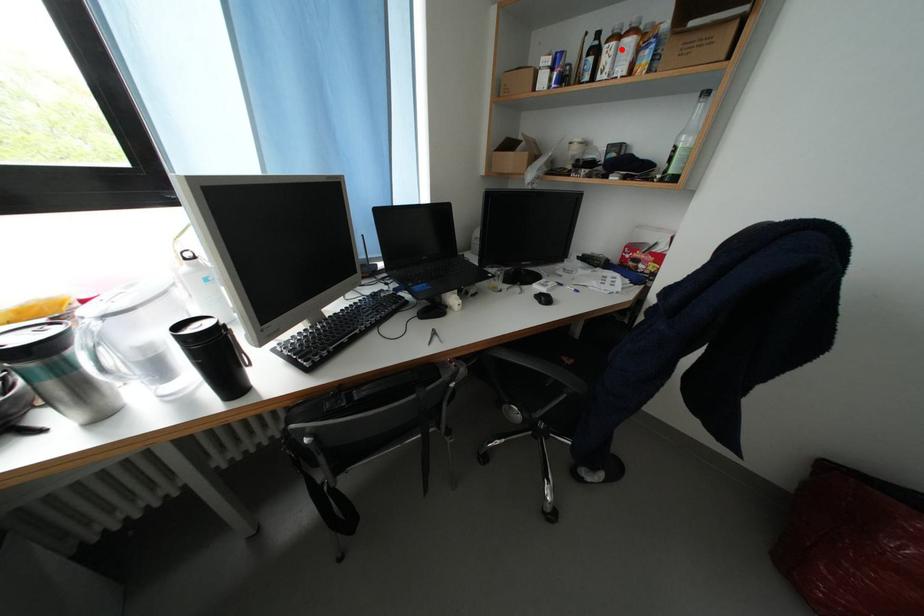
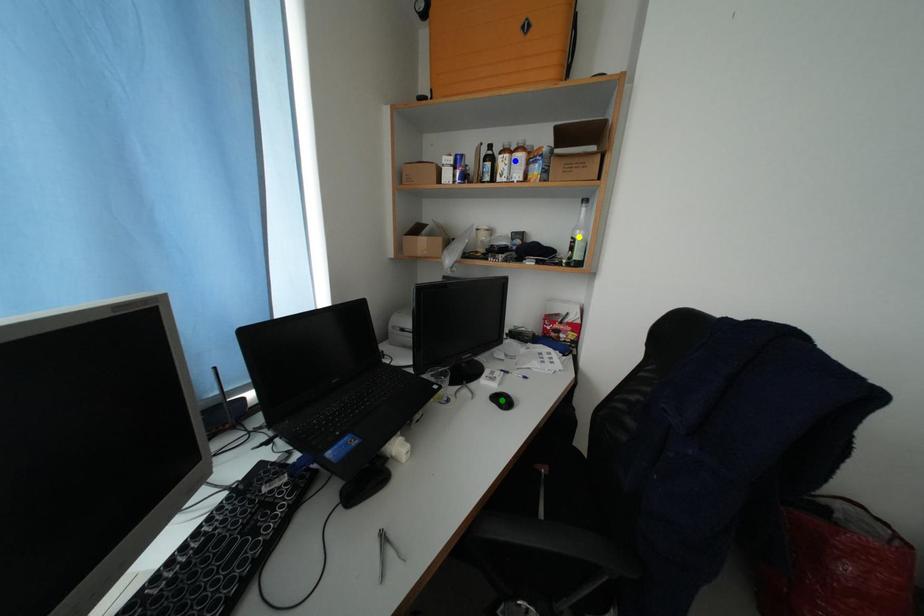
Question: I am providing you with two images of the same scene from different viewpoints. A red point is marked on the first image. You are given multiple points on the second image. Which point in image 2 represents the same 3d spot as the red point in image 1?

Choices:
 (A) blue point
 (B) yellow point
 (C) green point

Answer: (A)